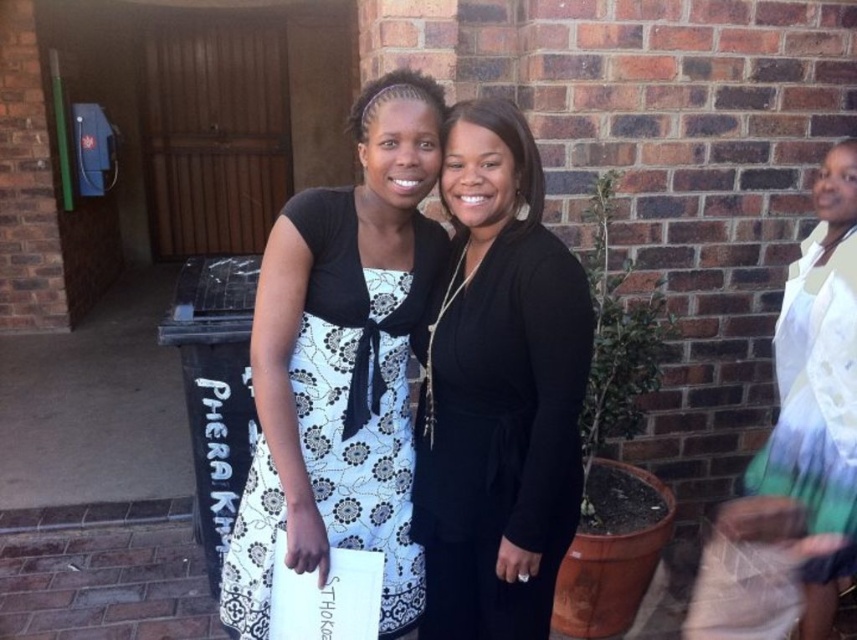
Which of these two, black matte dress at center or white textured dress at right, stands shorter?

With less height is white textured dress at right.

Who is higher up, black matte dress at center or white textured dress at right?

black matte dress at center

Between point (466, 225) and point (818, 380), which one is positioned in front?

Point (466, 225) is in front.

Locate an element on the screen. The image size is (857, 640). black matte dress at center is located at coordinates (498, 390).

Does point (574, 358) come behind point (285, 512)?

No, (574, 358) is closer to viewer.

In the scene shown: Which of these two, black matte dress at center or white floral dress at center, stands taller?

With more height is black matte dress at center.

Is point (466, 515) behind point (384, 488)?

No, (466, 515) is closer to viewer.

Identify the location of black matte dress at center. (498, 390).

Is white floral dress at center taller than white textured dress at right?

Yes, white floral dress at center is taller than white textured dress at right.

Does white floral dress at center have a greater width compared to white textured dress at right?

Correct, the width of white floral dress at center exceeds that of white textured dress at right.

At what (x,y) coordinates should I click in order to perform the action: click on white floral dress at center. Please return your answer as a coordinate pair (x, y). This screenshot has height=640, width=857. Looking at the image, I should click on (358, 388).

Where is `white floral dress at center`? white floral dress at center is located at coordinates (358, 388).